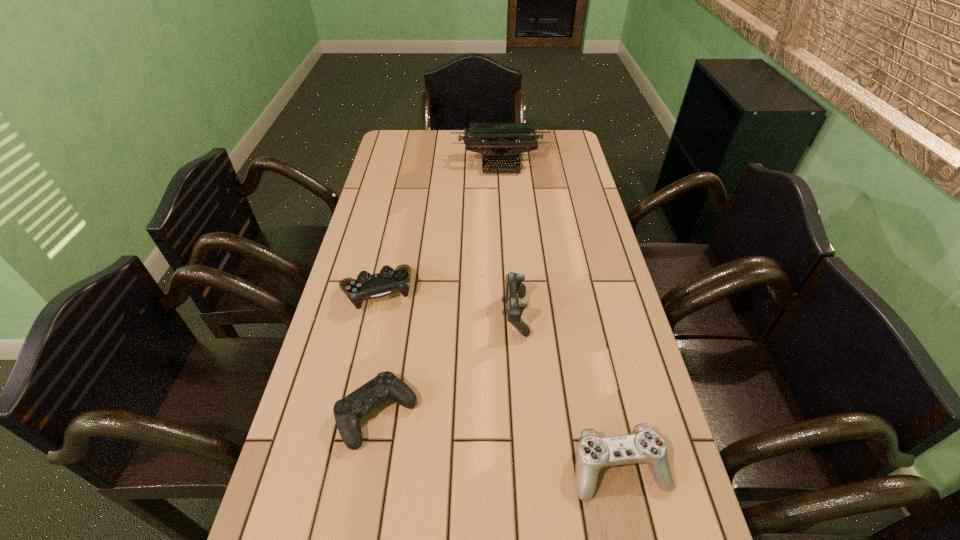
Where is `control that is the third nearest to the rightmost control`? The width and height of the screenshot is (960, 540). control that is the third nearest to the rightmost control is located at coordinates (366, 286).

Select which control appears as the second closest to the rightmost control. Please provide its 2D coordinates. Your answer should be formatted as a tuple, i.e. [(x, y)], where the tuple contains the x and y coordinates of a point satisfying the conditions above.

[(348, 411)]

You are a GUI agent. You are given a task and a screenshot of the screen. Output one action in this format:
    pyautogui.click(x=<x>, y=<y>)
    Task: Click on the vacant space that satisfies the following two spatial constraints: 1. on the surface of the fourth shortest object with buttons; 2. on the right side of the rightmost control
    This screenshot has height=540, width=960.
    Given the screenshot: What is the action you would take?
    pyautogui.click(x=525, y=468)

What are the coordinates of `vacant area that satisfies the following two spatial constraints: 1. on the surface of the third control from left to right with buttons; 2. on the right side of the rightmost control` in the screenshot? It's located at (525, 468).

Locate an element on the screen. This screenshot has width=960, height=540. free spot that satisfies the following two spatial constraints: 1. on the typing side of the typewriter; 2. on the left side of the rightmost control is located at coordinates (519, 468).